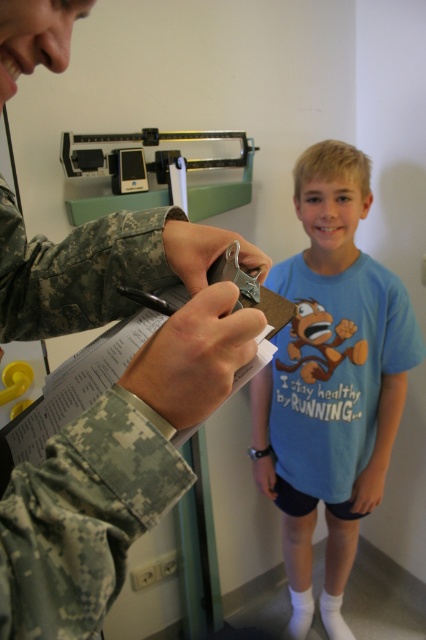
You are a healthcare professional observing the scene. You need to determine which object takes up more visual space in the image between the camouflage uniform at center and the blue cotton shirt at center. Which one is larger?

The blue cotton shirt at center occupies more visual space than the camouflage uniform at center because the camouflage uniform at center occupies less space than blue cotton shirt at center.

In the scene shown: You are a drone operator trying to capture a photo of the two points in the scene. The first point is at coordinates point (x=48, y=310) and the second is at point (x=359, y=522). Which point will appear larger in your camera view?

Point (x=48, y=310) is closer to the viewer than point (x=359, y=522), so it will appear larger in the camera view.

You are a medical professional trying to locate a specific point on the camouflage uniform at center. Where would you find the point at coordinates (109, 404)?

The point at coordinates (109, 404) is located on the camouflage uniform at center.